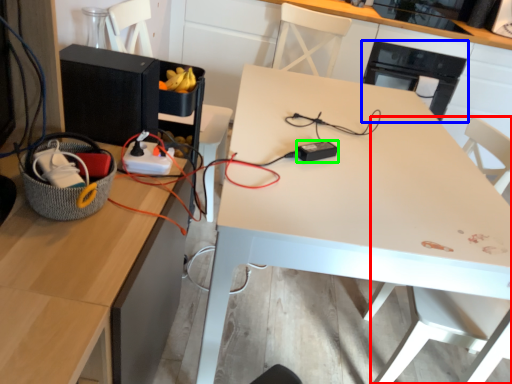
Question: Which object is the farthest from swivel chair (highlighted by a red box)? Choose among these: appliance (highlighted by a blue box) or appliance (highlighted by a green box).

Choices:
 (A) appliance
 (B) appliance

Answer: (A)